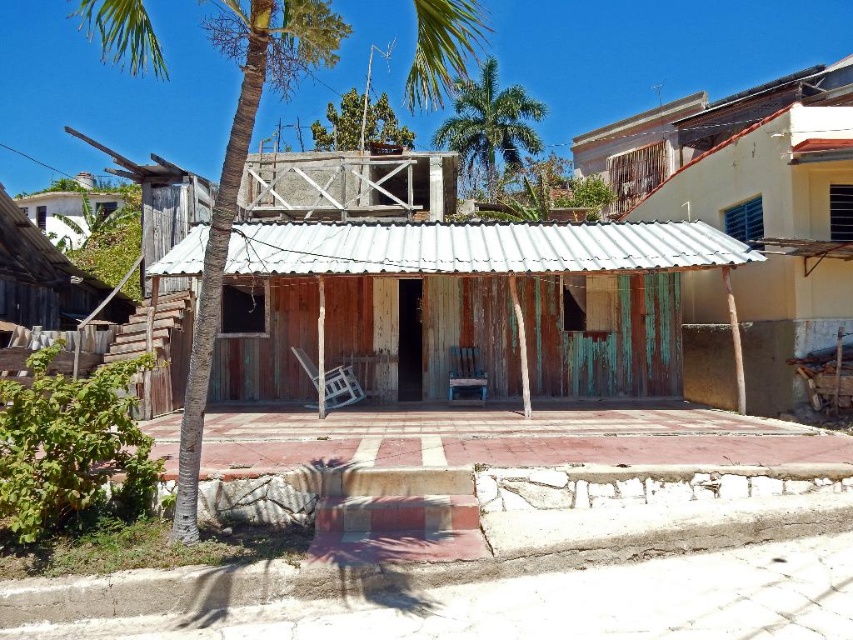
Between point (265, 264) and point (247, 93), which one is positioned behind?

The point (265, 264) is behind.

Looking at this image, can you confirm if green weathered wood hut at center is positioned to the right of green leafy palm tree at center?

Correct, you'll find green weathered wood hut at center to the right of green leafy palm tree at center.

Locate an element on the screen. The width and height of the screenshot is (853, 640). green weathered wood hut at center is located at coordinates (467, 305).

Is green weathered wood hut at center to the left of green leafy palm tree at upper center from the viewer's perspective?

Indeed, green weathered wood hut at center is positioned on the left side of green leafy palm tree at upper center.

Which is in front, point (492, 278) or point (491, 72)?

Point (492, 278)

Find the location of `green weathered wood hut at center`. green weathered wood hut at center is located at coordinates (467, 305).

Which is above, green leafy palm tree at center or green leafy palm tree at upper center?

green leafy palm tree at center is higher up.

Consider the image. Is green leafy palm tree at center positioned in front of green leafy palm tree at upper center?

Yes, green leafy palm tree at center is closer to the viewer.

Where is `green leafy palm tree at center`? The image size is (853, 640). green leafy palm tree at center is located at coordinates (239, 180).